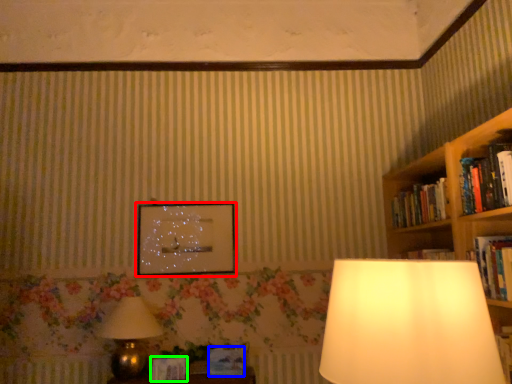
Question: Considering the real-world distances, which object is closest to picture frame (highlighted by a red box)? paperback book (highlighted by a blue box) or paperback book (highlighted by a green box).

Choices:
 (A) paperback book
 (B) paperback book

Answer: (A)